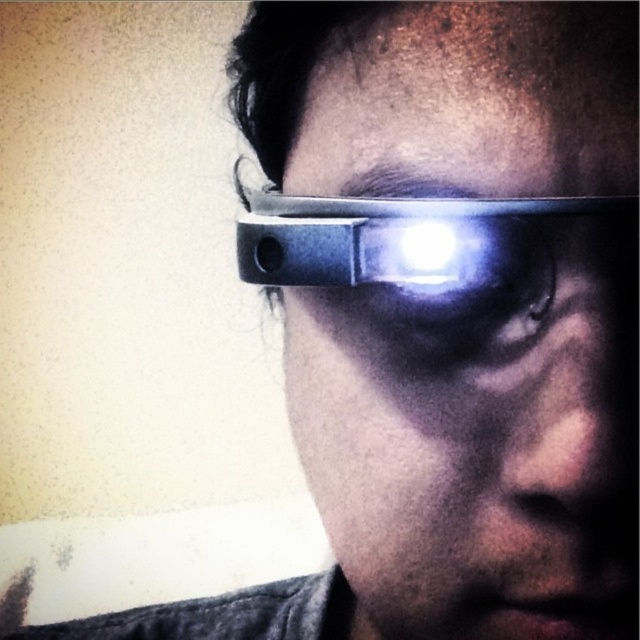
Image resolution: width=640 pixels, height=640 pixels. In order to click on matte black glasses at center in this screenshot , I will do `click(472, 456)`.

Between matte black glasses at center and matte black headband at center, which one appears on the left side from the viewer's perspective?

matte black headband at center is more to the left.

The height and width of the screenshot is (640, 640). Find the location of `matte black glasses at center`. matte black glasses at center is located at coordinates (472, 456).